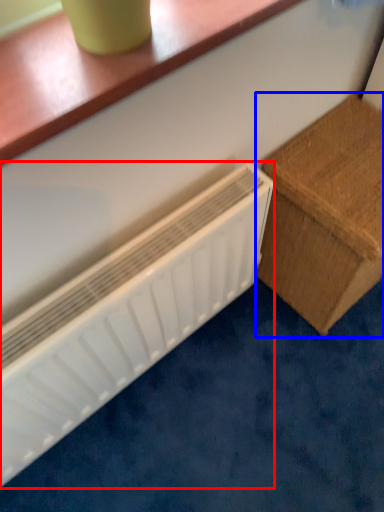
Question: Which object is further to the camera taking this photo, radiator (highlighted by a red box) or furniture (highlighted by a blue box)?

Choices:
 (A) radiator
 (B) furniture

Answer: (B)